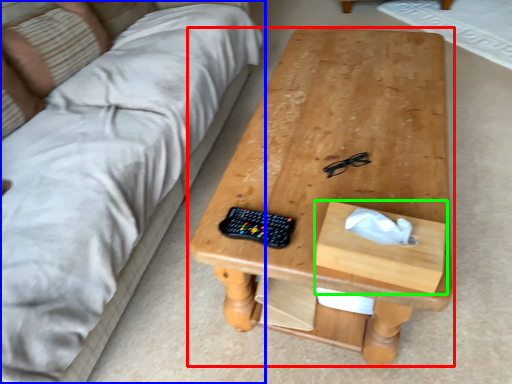
Question: Which object is positioned farthest from table (highlighted by a red box)? Select from studio couch (highlighted by a blue box) and drawer (highlighted by a green box).

Choices:
 (A) studio couch
 (B) drawer

Answer: (A)